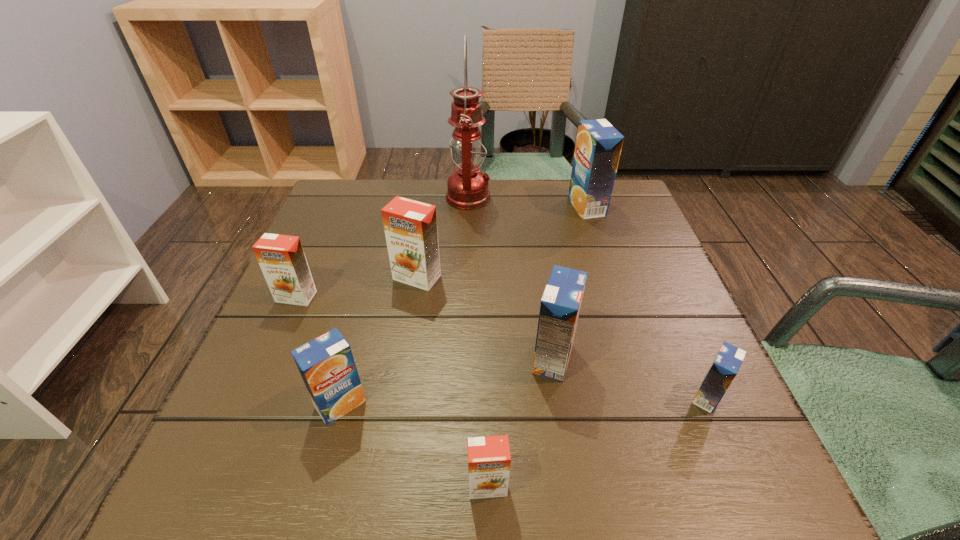
Locate an element on the screen. This screenshot has height=540, width=960. the rightmost object is located at coordinates (725, 366).

Where is `the smallest blue orange_juice`? This screenshot has height=540, width=960. the smallest blue orange_juice is located at coordinates (725, 366).

The height and width of the screenshot is (540, 960). I want to click on the fourth orange juice from right to left, so click(489, 458).

You are a GUI agent. You are given a task and a screenshot of the screen. Output one action in this format:
    pyautogui.click(x=<x>, y=<y>)
    Task: Click on the nearest orange juice
    The image size is (960, 540).
    Given the screenshot: What is the action you would take?
    pyautogui.click(x=489, y=458)

Find the location of a particular element. The width and height of the screenshot is (960, 540). free spot located on the right of the tallest object is located at coordinates (619, 198).

Locate an element on the screen. Image resolution: width=960 pixels, height=540 pixels. free region located 0.250m on the left of the second blue orange_juice from right to left is located at coordinates (476, 207).

In order to click on free point located on the back of the biggest orange orange juice in this screenshot , I will do `click(422, 245)`.

You are a GUI agent. You are given a task and a screenshot of the screen. Output one action in this format:
    pyautogui.click(x=<x>, y=<y>)
    Task: Click on the vacant point located 0.360m on the back of the third smallest blue orange_juice
    Image resolution: width=960 pixels, height=540 pixels.
    Given the screenshot: What is the action you would take?
    pos(533,226)

Where is `free space located 0.070m on the back of the second smallest orange orange juice`? This screenshot has height=540, width=960. free space located 0.070m on the back of the second smallest orange orange juice is located at coordinates (310, 266).

The image size is (960, 540). I want to click on vacant space located on the left of the second smallest blue orange_juice, so click(255, 404).